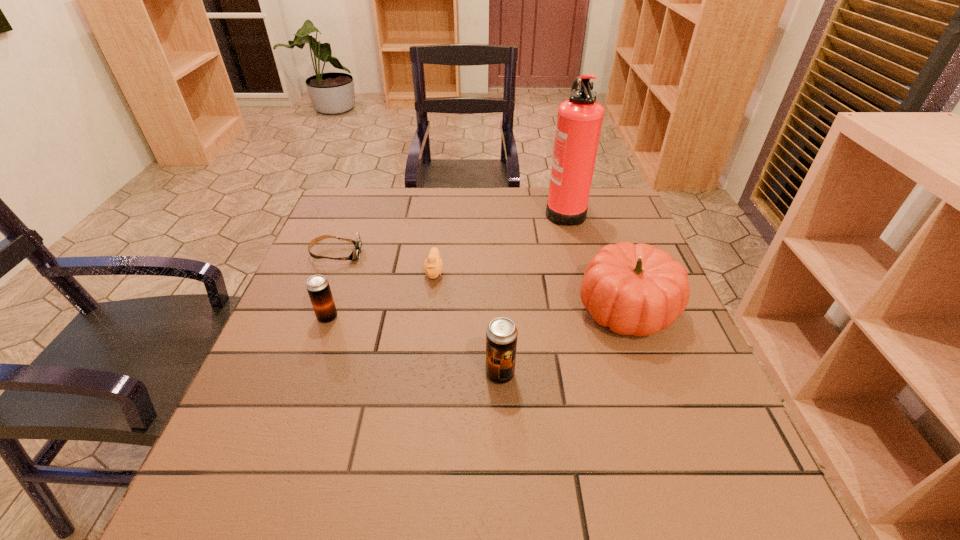
The image size is (960, 540). Find the location of `blank space that satisfies the following two spatial constraints: 1. at the nozzle of the tallest object; 2. on the face of the duckling`. blank space that satisfies the following two spatial constraints: 1. at the nozzle of the tallest object; 2. on the face of the duckling is located at coordinates (581, 272).

What are the coordinates of `free space that satisfies the following two spatial constraints: 1. on the front-facing side of the shortest object; 2. on the right side of the farther beer can` in the screenshot? It's located at (311, 318).

Identify the location of free region that satisfies the following two spatial constraints: 1. at the nozzle of the farthest object; 2. on the back side of the pumpkin. (591, 310).